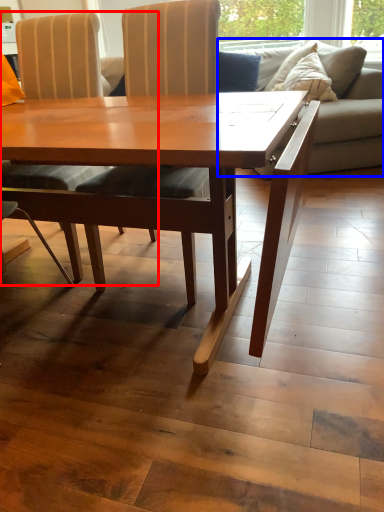
Question: Which object appears closest to the camera in this image, chair (highlighted by a red box) or studio couch (highlighted by a blue box)?

Choices:
 (A) chair
 (B) studio couch

Answer: (A)